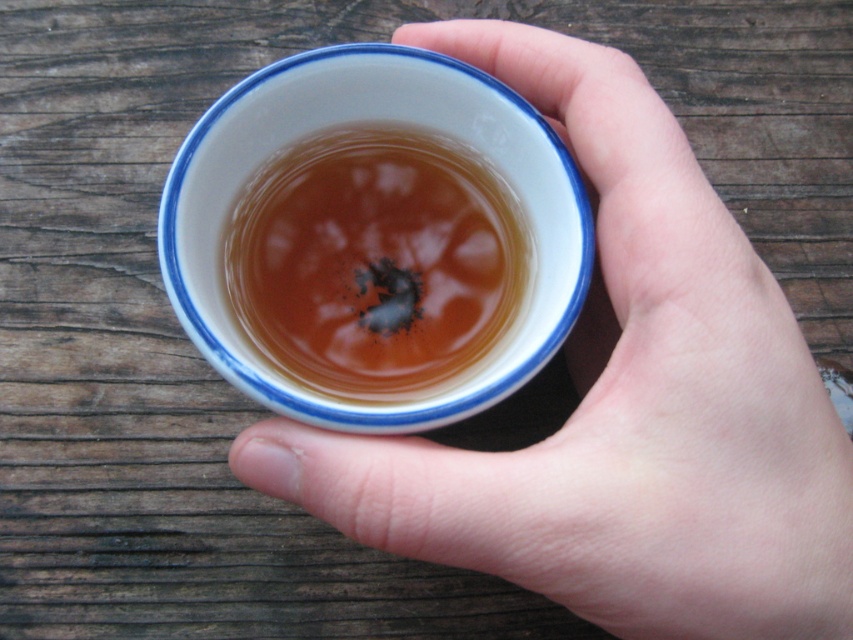
Is white glossy cup at center thinner than translucent amber liquid at center?

In fact, white glossy cup at center might be wider than translucent amber liquid at center.

Is white glossy cup at center positioned at the back of translucent amber liquid at center?

That is False.

In order to click on white glossy cup at center in this screenshot , I will do `click(622, 403)`.